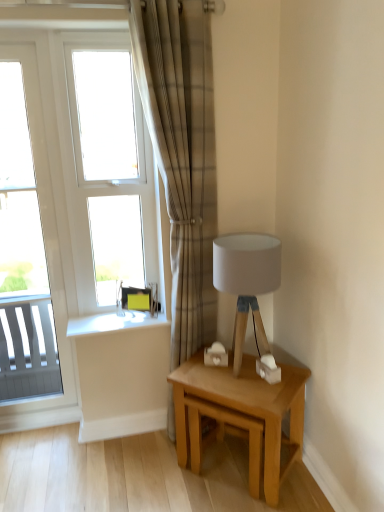
Measure the distance between light oak wooden table at lower right and camera.

5.71 feet.

The image size is (384, 512). What do you see at coordinates (48, 223) in the screenshot?
I see `white glossy window at left, acting as the 1th window starting from the left` at bounding box center [48, 223].

The height and width of the screenshot is (512, 384). What do you see at coordinates (246, 280) in the screenshot? I see `white fabric lampshade at upper right` at bounding box center [246, 280].

What do you see at coordinates (109, 162) in the screenshot?
I see `white glass window at upper left, the second window when ordered from left to right` at bounding box center [109, 162].

I want to click on light oak wooden table at lower right, so click(241, 415).

Is white fabric lampshade at upper right taller than white glossy window at left, acting as the 1th window starting from the left?

Incorrect, the height of white fabric lampshade at upper right is not larger of that of white glossy window at left, acting as the 1th window starting from the left.

From the picture: Measure the distance from white fabric lampshade at upper right to white glossy window at left, acting as the 1th window starting from the left.

white fabric lampshade at upper right and white glossy window at left, acting as the 1th window starting from the left, are 99.01 centimeters apart from each other.

From a real-world perspective, which is physically below, white fabric lampshade at upper right or white glossy window at left, acting as the 1th window starting from the left?

From a 3D spatial view, white fabric lampshade at upper right is below.

Could you tell me if white fabric lampshade at upper right is facing white glossy window at left, acting as the 1th window starting from the left?

No, white fabric lampshade at upper right is not turned towards white glossy window at left, acting as the 1th window starting from the left.

From the image's perspective, is white glass window at upper left, which is the 1th window in right-to-left order, located above or below light oak wooden table at lower right?

white glass window at upper left, which is the 1th window in right-to-left order, is above light oak wooden table at lower right.

Between white glass window at upper left, the second window when ordered from left to right, and light oak wooden table at lower right, which one has larger size?

light oak wooden table at lower right is bigger.

Find the location of a particular element. The image size is (384, 512). table located on the right of white glass window at upper left, which is the 1th window in right-to-left order is located at coordinates (241, 415).

Which point is more distant from viewer, (132,111) or (251,478)?

The point (132,111) is behind.

Between white fabric lampshade at upper right and plaid fabric curtain at center, which one has smaller width?

Thinner between the two is plaid fabric curtain at center.

Is white fabric lampshade at upper right completely or partially outside of plaid fabric curtain at center?

Absolutely, white fabric lampshade at upper right is external to plaid fabric curtain at center.

From a real-world perspective, is white fabric lampshade at upper right on top of plaid fabric curtain at center?

No, from a real-world perspective, white fabric lampshade at upper right is not above plaid fabric curtain at center.

Based on their sizes in the image, would you say white fabric lampshade at upper right is bigger or smaller than plaid fabric curtain at center?

In the image, white fabric lampshade at upper right appears to be smaller than plaid fabric curtain at center.

Considering the sizes of objects white fabric lampshade at upper right and light oak wooden table at lower right in the image provided, who is taller, white fabric lampshade at upper right or light oak wooden table at lower right?

With more height is white fabric lampshade at upper right.

From the picture: Between white fabric lampshade at upper right and light oak wooden table at lower right, which one has smaller width?

Thinner between the two is white fabric lampshade at upper right.

In terms of size, does white fabric lampshade at upper right appear bigger or smaller than light oak wooden table at lower right?

white fabric lampshade at upper right is smaller than light oak wooden table at lower right.

Who is bigger, white glossy window at left, acting as the 1th window starting from the left, or white glass window at upper left, the second window when ordered from left to right?

white glossy window at left, acting as the 1th window starting from the left, is bigger.

Is white glossy window at left, which is the second window in right-to-left order, placed right next to white glass window at upper left, the second window when ordered from left to right?

No, white glossy window at left, which is the second window in right-to-left order, is not making contact with white glass window at upper left, the second window when ordered from left to right.

At what (x,y) coordinates should I click in order to perform the action: click on window behind the white glossy window at left, which is the second window in right-to-left order. Please return your answer as a coordinate pair (x, y). This screenshot has width=384, height=512. Looking at the image, I should click on (109, 162).

Considering the positions of objects white glossy window at left, acting as the 1th window starting from the left, and white glass window at upper left, which is the 1th window in right-to-left order, in the image provided, who is behind, white glossy window at left, acting as the 1th window starting from the left, or white glass window at upper left, which is the 1th window in right-to-left order,?

white glass window at upper left, which is the 1th window in right-to-left order.

Who is shorter, plaid fabric curtain at center or light oak wooden table at lower right?

With less height is light oak wooden table at lower right.

Which is less distant, (186, 298) or (182, 387)?

Point (186, 298) is positioned farther from the camera compared to point (182, 387).

Are plaid fabric curtain at center and light oak wooden table at lower right located far from each other?

That's not correct — plaid fabric curtain at center is a little close to light oak wooden table at lower right.

Identify the location of curtain in front of the light oak wooden table at lower right. This screenshot has width=384, height=512. (182, 153).

Does white glass window at upper left, which is the 1th window in right-to-left order, have a greater height compared to white glossy window at left, which is the second window in right-to-left order?

No.

Is white glass window at upper left, which is the 1th window in right-to-left order, outside of white glossy window at left, which is the second window in right-to-left order?

That's correct, white glass window at upper left, which is the 1th window in right-to-left order, is outside of white glossy window at left, which is the second window in right-to-left order.

From the image's perspective, which is below, white glass window at upper left, which is the 1th window in right-to-left order, or white glossy window at left, acting as the 1th window starting from the left?

From the image's view, white glossy window at left, acting as the 1th window starting from the left, is below.

At what (x,y) coordinates should I click in order to perform the action: click on window on the right of white glossy window at left, acting as the 1th window starting from the left. Please return your answer as a coordinate pair (x, y). Image resolution: width=384 pixels, height=512 pixels. Looking at the image, I should click on (109, 162).

Locate an element on the screen. This screenshot has width=384, height=512. the 2nd window to the left when counting from the white fabric lampshade at upper right is located at coordinates (48, 223).

From the light oak wooden table at lower right, count 2nd windows backward and point to it. Please provide its 2D coordinates.

[(109, 162)]

From the image, which object appears to be farther from white fabric lampshade at upper right, white glossy window at left, acting as the 1th window starting from the left, or light oak wooden table at lower right?

white glossy window at left, acting as the 1th window starting from the left, lies further to white fabric lampshade at upper right than the other object.

Which object lies further to the anchor point white fabric lampshade at upper right, white glass window at upper left, which is the 1th window in right-to-left order, or light oak wooden table at lower right?

white glass window at upper left, which is the 1th window in right-to-left order, lies further to white fabric lampshade at upper right than the other object.

When comparing their distances from light oak wooden table at lower right, does white fabric lampshade at upper right or white glass window at upper left, the second window when ordered from left to right, seem closer?

white fabric lampshade at upper right is positioned closer to the anchor light oak wooden table at lower right.

From the image, which object appears to be nearer to light oak wooden table at lower right, white fabric lampshade at upper right or white glossy window at left, which is the second window in right-to-left order?

white fabric lampshade at upper right lies closer to light oak wooden table at lower right than the other object.

Looking at the image, which one is located further to white glass window at upper left, the second window when ordered from left to right, white fabric lampshade at upper right or plaid fabric curtain at center?

white fabric lampshade at upper right is positioned further to the anchor white glass window at upper left, the second window when ordered from left to right.

Considering their positions, is white fabric lampshade at upper right positioned closer to light oak wooden table at lower right than plaid fabric curtain at center?

Among the two, white fabric lampshade at upper right is located nearer to light oak wooden table at lower right.

Looking at the image, which one is located further to light oak wooden table at lower right, white glass window at upper left, the second window when ordered from left to right, or white fabric lampshade at upper right?

Among the two, white glass window at upper left, the second window when ordered from left to right, is located further to light oak wooden table at lower right.

Looking at the image, which one is located closer to white fabric lampshade at upper right, light oak wooden table at lower right or white glass window at upper left, which is the 1th window in right-to-left order?

light oak wooden table at lower right is closer to white fabric lampshade at upper right.

Identify the location of curtain situated between white glossy window at left, which is the second window in right-to-left order, and white fabric lampshade at upper right from left to right. The height and width of the screenshot is (512, 384). (182, 153).

Locate an element on the screen. This screenshot has height=512, width=384. window located between white glossy window at left, which is the second window in right-to-left order, and plaid fabric curtain at center in the left-right direction is located at coordinates (109, 162).

You are a GUI agent. You are given a task and a screenshot of the screen. Output one action in this format:
    pyautogui.click(x=<x>, y=<y>)
    Task: Click on the curtain between white glass window at upper left, which is the 1th window in right-to-left order, and light oak wooden table at lower right in the up-down direction
    This screenshot has height=512, width=384.
    Given the screenshot: What is the action you would take?
    pyautogui.click(x=182, y=153)

Where is `table lamp between plaid fabric curtain at center and light oak wooden table at lower right in the vertical direction`? table lamp between plaid fabric curtain at center and light oak wooden table at lower right in the vertical direction is located at coordinates (246, 280).